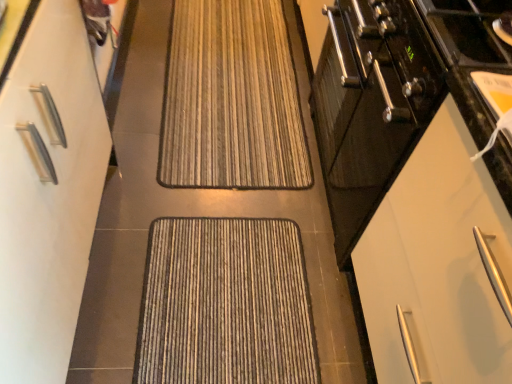
Question: From the image's perspective, would you say white matte cabinet at right, the 1th cabinetry from the right, is positioned over white matte cabinet at left, arranged as the 1th cabinetry when viewed from the left?

Choices:
 (A) yes
 (B) no

Answer: (B)

Question: Does white matte cabinet at right, the 1th cabinetry from the right, have a larger size compared to white matte cabinet at left, marked as the 2th cabinetry in a right-to-left arrangement?

Choices:
 (A) yes
 (B) no

Answer: (B)

Question: Is white matte cabinet at right, the 1th cabinetry from the right, further to the viewer compared to white matte cabinet at left, marked as the 2th cabinetry in a right-to-left arrangement?

Choices:
 (A) no
 (B) yes

Answer: (B)

Question: From a real-world perspective, is white matte cabinet at right, the 1th cabinetry from the right, beneath white matte cabinet at left, arranged as the 1th cabinetry when viewed from the left?

Choices:
 (A) no
 (B) yes

Answer: (A)

Question: Is white matte cabinet at right, the 1th cabinetry from the right, taller than white matte cabinet at left, marked as the 2th cabinetry in a right-to-left arrangement?

Choices:
 (A) yes
 (B) no

Answer: (B)

Question: From the image's perspective, does white matte cabinet at right, arranged as the 2th cabinetry when viewed from the left, appear lower than white matte cabinet at left, marked as the 2th cabinetry in a right-to-left arrangement?

Choices:
 (A) no
 (B) yes

Answer: (B)

Question: Is white matte cabinet at right, arranged as the 2th cabinetry when viewed from the left, far away from textured brown doormat at center, which is the first doormat from front to back?

Choices:
 (A) yes
 (B) no

Answer: (B)

Question: From the image's perspective, would you say white matte cabinet at right, arranged as the 2th cabinetry when viewed from the left, is shown under textured brown doormat at center, the first doormat positioned from the bottom?

Choices:
 (A) no
 (B) yes

Answer: (A)

Question: Is white matte cabinet at right, the 1th cabinetry from the right, taller than textured brown doormat at center, the first doormat positioned from the bottom?

Choices:
 (A) yes
 (B) no

Answer: (A)

Question: Would you say textured brown doormat at center, the second doormat positioned from the top, is part of white matte cabinet at right, the 1th cabinetry from the right,'s contents?

Choices:
 (A) no
 (B) yes

Answer: (A)

Question: Considering the relative positions of white matte cabinet at right, the 1th cabinetry from the right, and textured brown doormat at center, acting as the 2th doormat starting from the back, in the image provided, is white matte cabinet at right, the 1th cabinetry from the right, behind textured brown doormat at center, acting as the 2th doormat starting from the back,?

Choices:
 (A) yes
 (B) no

Answer: (B)

Question: From a real-world perspective, is white matte cabinet at right, arranged as the 2th cabinetry when viewed from the left, positioned under textured brown doormat at center, acting as the 2th doormat starting from the back, based on gravity?

Choices:
 (A) yes
 (B) no

Answer: (B)

Question: From a real-world perspective, is white matte cabinet at left, arranged as the 1th cabinetry when viewed from the left, physically below textured brown doormat at center, which is the first doormat from front to back?

Choices:
 (A) yes
 (B) no

Answer: (B)